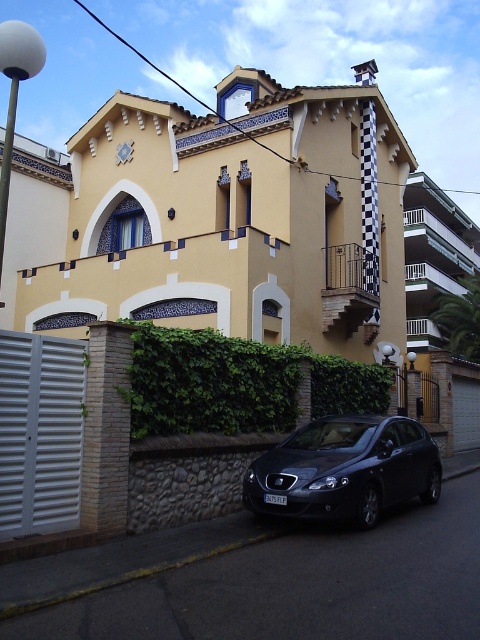
Describe the element at coordinates (239, 384) in the screenshot. The height and width of the screenshot is (640, 480). I see `green leafy hedge at center` at that location.

Between point (203, 417) and point (334, 493), which one is positioned in front?

Point (334, 493) is in front.

Image resolution: width=480 pixels, height=640 pixels. In order to click on green leafy hedge at center in this screenshot , I will do `click(239, 384)`.